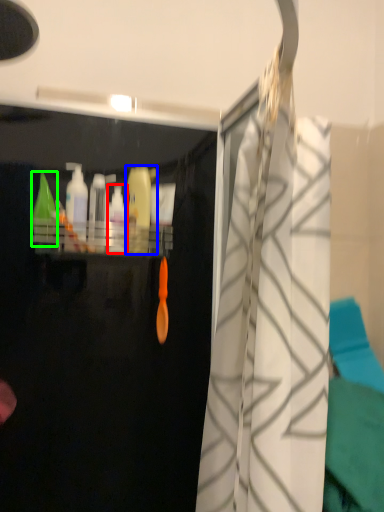
Question: Which object is positioned farthest from cleaning product (highlighted by a red box)? Select from cleaning product (highlighted by a blue box) and cleaning product (highlighted by a green box).

Choices:
 (A) cleaning product
 (B) cleaning product

Answer: (B)